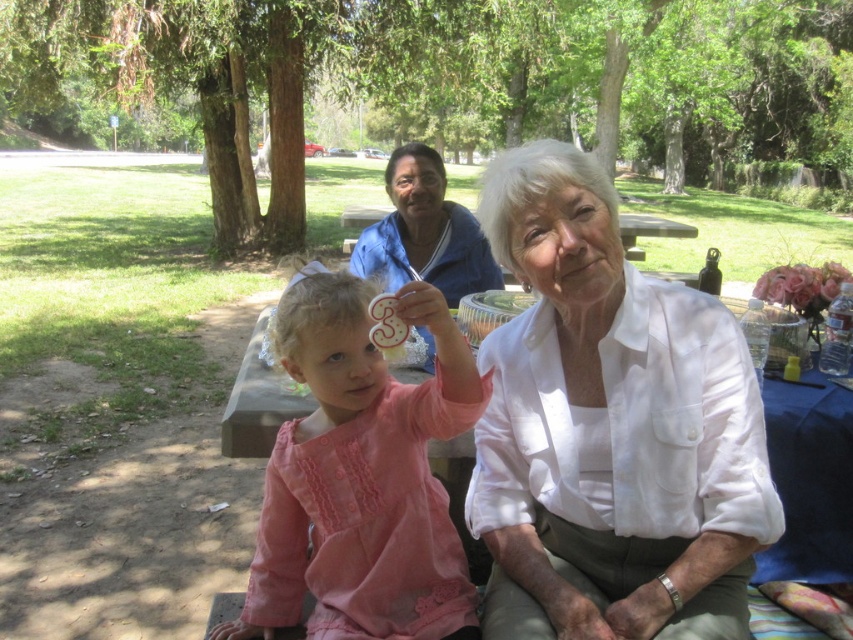
Question: Which object is the closest to the white cotton blouse at center?

Choices:
 (A) white cotton shirt at center
 (B) pink fabric dress at center

Answer: (B)

Question: Is white cotton blouse at center to the left of white cotton shirt at center from the viewer's perspective?

Choices:
 (A) yes
 (B) no

Answer: (B)

Question: Does white cotton blouse at center appear on the right side of pink fabric dress at center?

Choices:
 (A) yes
 (B) no

Answer: (A)

Question: Is white cotton blouse at center below pink fabric dress at center?

Choices:
 (A) no
 (B) yes

Answer: (A)

Question: Which point is farther from the camera taking this photo?

Choices:
 (A) (300, 529)
 (B) (410, 212)

Answer: (B)

Question: Which of the following is the farthest from the observer?

Choices:
 (A) pink fabric dress at center
 (B) white cotton blouse at center

Answer: (B)